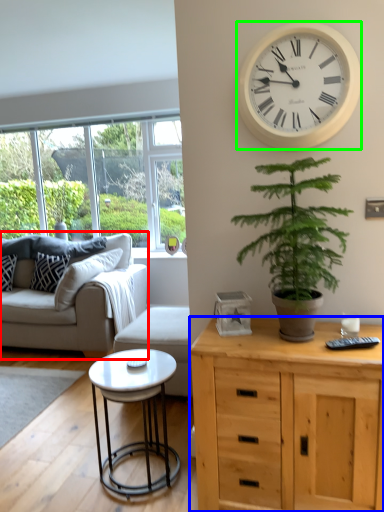
Question: Which is farther away from studio couch (highlighted by a red box)? cabinetry (highlighted by a blue box) or wall clock (highlighted by a green box)?

Choices:
 (A) cabinetry
 (B) wall clock

Answer: (B)